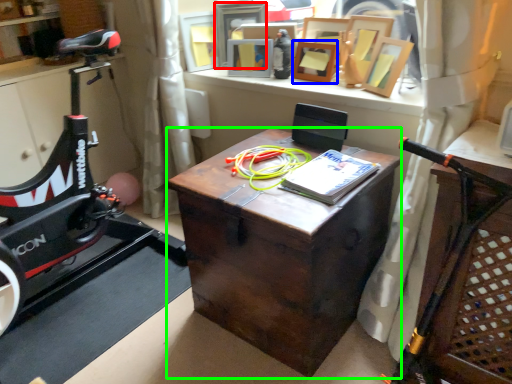
Question: Estimate the real-world distances between objects in this image. Which object is farther from picture frame (highlighted by a red box), picture frame (highlighted by a blue box) or desk (highlighted by a green box)?

Choices:
 (A) picture frame
 (B) desk

Answer: (B)